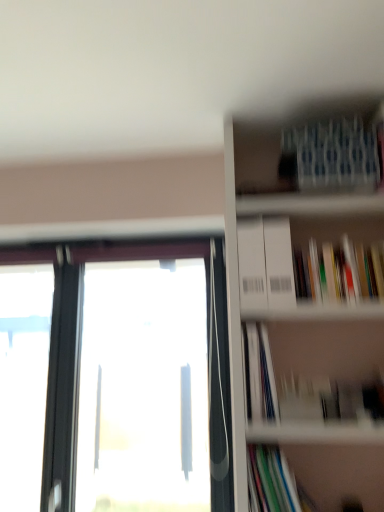
Question: Is point (175, 473) positioned closer to the camera than point (294, 150)?

Choices:
 (A) farther
 (B) closer

Answer: (A)

Question: Is transparent glass window at left wider or thinner than white cardboard bookcase at upper right?

Choices:
 (A) thin
 (B) wide

Answer: (A)

Question: Which object is the farthest from the multicolored paperbacks at upper right, marked as the 2th book in a top-to-bottom arrangement?

Choices:
 (A) white paper at center-right, which ranks as the second book in bottom-to-top order
 (B) blue textured fabric at upper right, the 1th book positioned from the top
 (C) multicolored paper at lower right, placed as the fourth book when sorted from top to bottom
 (D) transparent glass window at left
 (E) white cardboard bookcase at upper right

Answer: (D)

Question: Which is farther from the multicolored paperbacks at upper right, marked as the 2th book in a top-to-bottom arrangement?

Choices:
 (A) transparent glass window at left
 (B) white cardboard bookcase at upper right
 (C) blue textured fabric at upper right, the 1th book positioned from the top
 (D) multicolored paper at lower right, placed as the fourth book when sorted from top to bottom
 (E) white paper at center-right, which ranks as the second book in bottom-to-top order

Answer: (A)